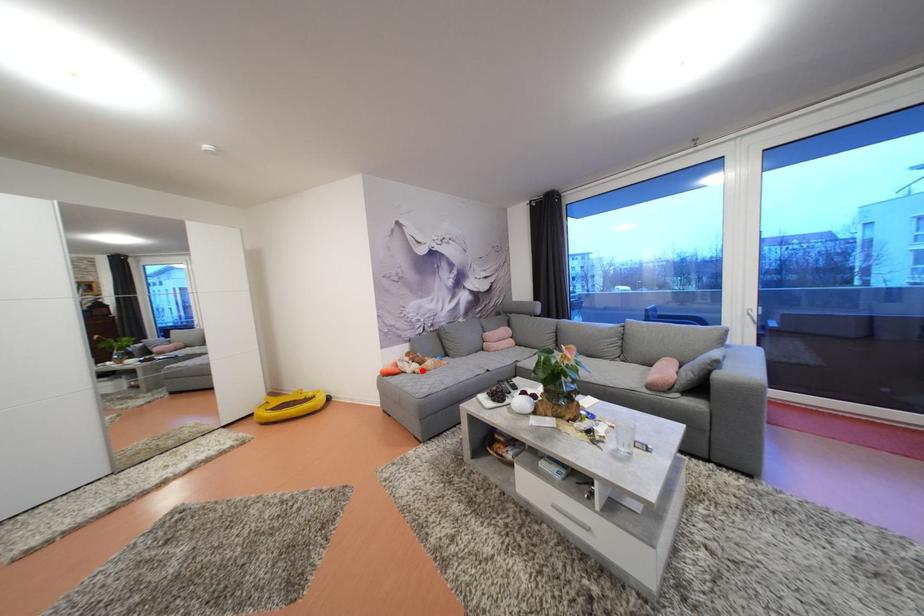
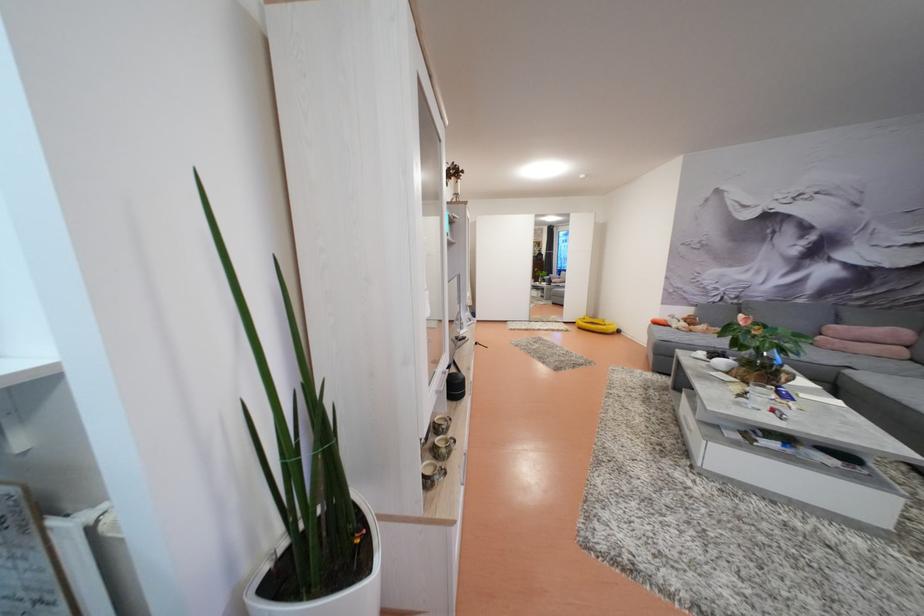
Question: I am providing you with two images of the same scene from different viewpoints. A red point is shown in image1. For the corresponding object point in image2, is it positioned nearer or farther from the camera?

Choices:
 (A) Nearer
 (B) Farther

Answer: (A)